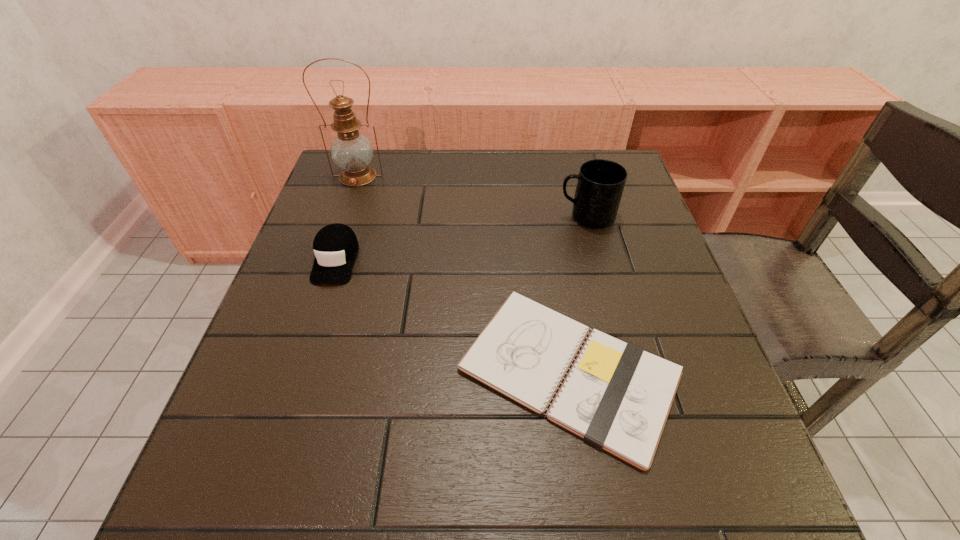
Find the location of `vacant point that satisfies the following two spatial constraints: 1. on the front-facing side of the notepad; 2. on the right side of the third farthest object`. vacant point that satisfies the following two spatial constraints: 1. on the front-facing side of the notepad; 2. on the right side of the third farthest object is located at coordinates (300, 371).

Find the location of a particular element. Image resolution: width=960 pixels, height=540 pixels. vacant area that satisfies the following two spatial constraints: 1. on the side of the second farthest object with the handle; 2. on the front-facing side of the third tallest object is located at coordinates (598, 260).

Identify the location of free space that satisfies the following two spatial constraints: 1. on the side of the mug with the handle; 2. on the front-facing side of the cap. The width and height of the screenshot is (960, 540). (598, 260).